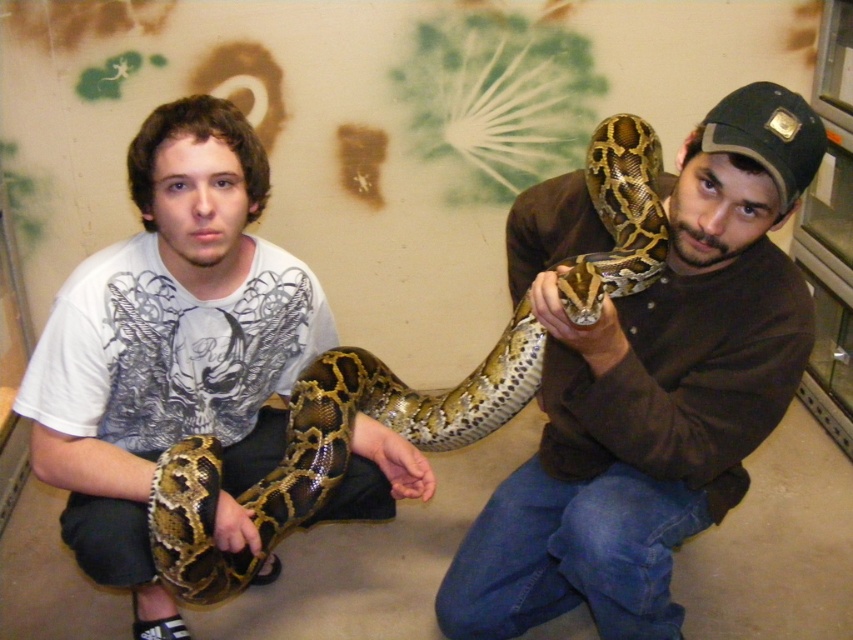
You are standing in the scene and need to reach the brown leather jacket at center. Given that you can stretch your arm 2.5 feet, can you grab it without moving your feet?

The brown leather jacket at center is 4.30 feet away from you. Since your arm can only stretch 2.5 feet, you cannot reach it without moving your feet.

You are a photographer trying to capture a clear shot of both the brown leather jacket at center and the shiny brown snake at center. Since you want to focus on the snake, where should you position the jacket relative to the snake to avoid blocking it?

The brown leather jacket at center is positioned on the right side of the shiny brown snake at center. To avoid blocking the snake, you should keep the jacket to the right of the snake.

You are trying to place a small potted plant on the floor near the brown leather jacket at center. Based on the coordinates provided, where should you position the plant relative to the jacket?

The brown leather jacket at center is located at point [646,385], so you should place the potted plant near those coordinates on the floor.